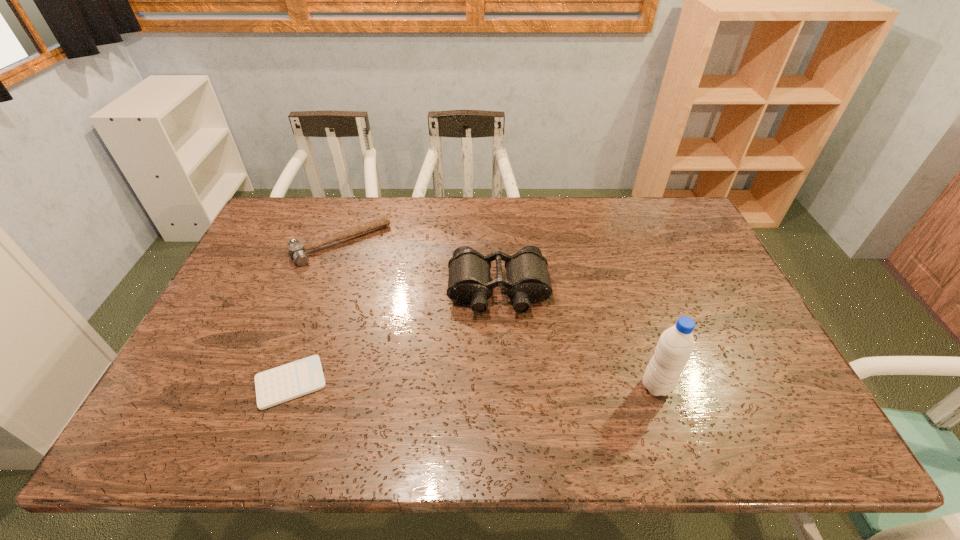
Locate an element on the screen. the shortest object is located at coordinates (275, 386).

You are a GUI agent. You are given a task and a screenshot of the screen. Output one action in this format:
    pyautogui.click(x=<x>, y=<y>)
    Task: Click on the tallest object
    Image resolution: width=960 pixels, height=540 pixels.
    Given the screenshot: What is the action you would take?
    pyautogui.click(x=676, y=344)

At what (x,y) coordinates should I click in order to perform the action: click on the rightmost object. Please return your answer as a coordinate pair (x, y). This screenshot has height=540, width=960. Looking at the image, I should click on (676, 344).

At what (x,y) coordinates should I click in order to perform the action: click on the second shortest object. Please return your answer as a coordinate pair (x, y). Looking at the image, I should click on (297, 251).

You are a GUI agent. You are given a task and a screenshot of the screen. Output one action in this format:
    pyautogui.click(x=<x>, y=<y>)
    Task: Click on the third object from left to right
    The height and width of the screenshot is (540, 960).
    Given the screenshot: What is the action you would take?
    pyautogui.click(x=469, y=282)

Where is `the third shortest object`? This screenshot has height=540, width=960. the third shortest object is located at coordinates (469, 282).

In order to click on free space located on the right of the shortest object in this screenshot , I will do `click(468, 383)`.

The height and width of the screenshot is (540, 960). I want to click on vacant space located on the back of the water bottle, so click(x=621, y=280).

This screenshot has height=540, width=960. I want to click on blank space located on the striking face of the hammer, so click(384, 305).

This screenshot has width=960, height=540. Find the location of `free space located on the striking face of the hammer`. free space located on the striking face of the hammer is located at coordinates (365, 274).